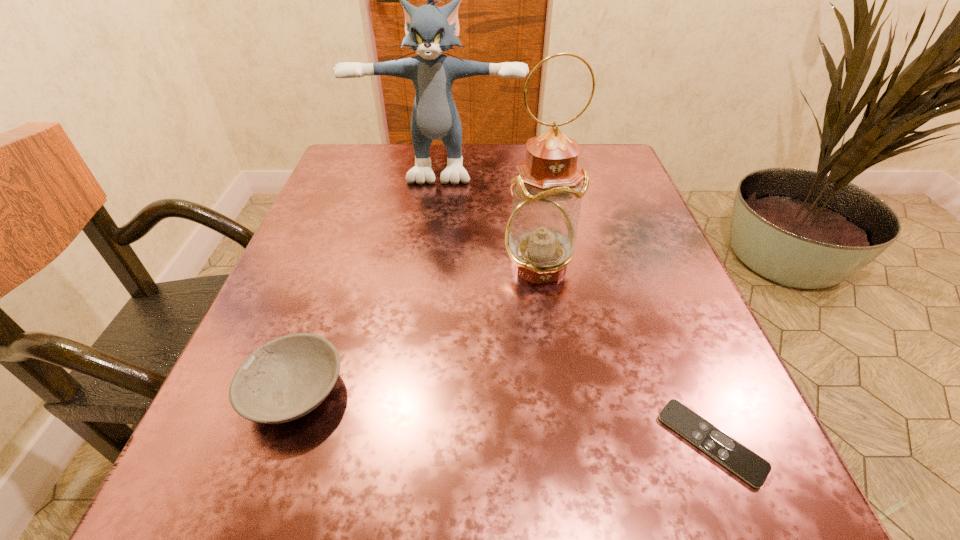
This screenshot has width=960, height=540. What are the coordinates of `the farthest object` in the screenshot? It's located at (430, 30).

This screenshot has width=960, height=540. Identify the location of oil lamp. (540, 238).

Where is `the third tallest object`? This screenshot has width=960, height=540. the third tallest object is located at coordinates (286, 378).

Find the location of a particular element. This screenshot has height=540, width=960. remote control is located at coordinates (753, 469).

Find the location of a particular element. The image size is (960, 540). the rightmost object is located at coordinates (753, 469).

Locate an element on the screen. The height and width of the screenshot is (540, 960). vacant space located 0.290m on the front-facing side of the farthest object is located at coordinates (426, 274).

Find the location of a particular element. The height and width of the screenshot is (540, 960). vacant area situated on the back of the oil lamp is located at coordinates (524, 171).

Where is `vacant region located on the right of the second shortest object`? The image size is (960, 540). vacant region located on the right of the second shortest object is located at coordinates 447,391.

Identify the location of blank space located on the left of the shortest object. (618, 442).

Where is `object located in the far edge section of the desktop`? This screenshot has height=540, width=960. object located in the far edge section of the desktop is located at coordinates (430, 30).